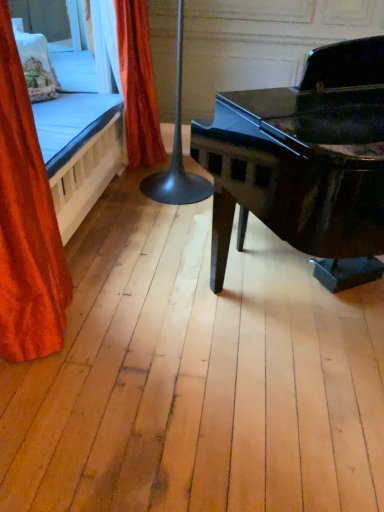
You are a GUI agent. You are given a task and a screenshot of the screen. Output one action in this format:
    pyautogui.click(x=<x>, y=<y>)
    Task: Click on the free location in front of embroidered fabric pillow at upper left
    
    Given the screenshot: What is the action you would take?
    pyautogui.click(x=46, y=108)